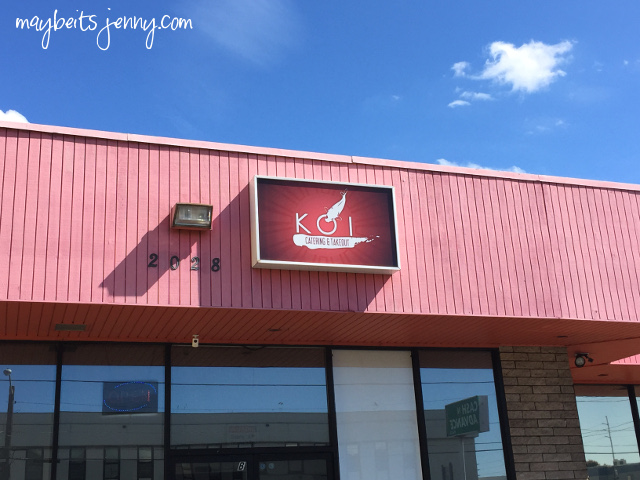
Image resolution: width=640 pixels, height=480 pixels. I want to click on windows, so click(35, 408), click(84, 412), click(291, 437), click(372, 423), click(438, 423).